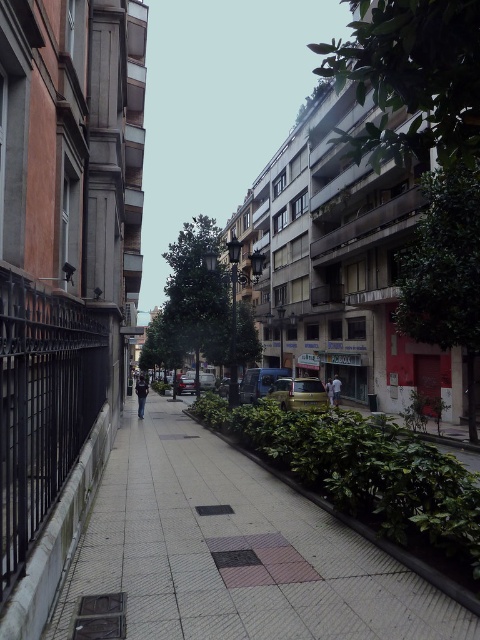
You are a delivery person standing on the gray concrete sidewalk at center and need to place a package on the light blue denim jacket at center. Is the jacket accessible from your current position?

The gray concrete sidewalk at center is positioned over the light blue denim jacket at center, so the jacket is not accessible from the sidewalk as it is underneath the sidewalk.

You are standing on the sidewalk of this narrow urban street. You notice two points marked on the buildings ahead of you. The first point is at coordinate point (139, 404) and the second is at point (336, 401). Which point is closer to your current position?

Point (139, 404) is closer to the camera than point (336, 401), so the first point is closer to your current position.